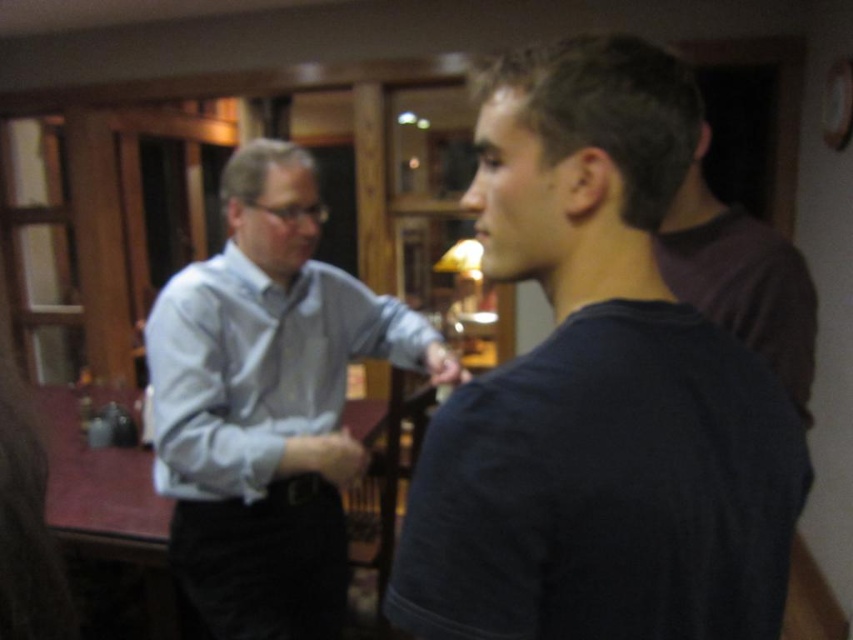
Does dark blue t-shirt at center have a greater height compared to light blue shirt at center?

No, dark blue t-shirt at center is not taller than light blue shirt at center.

Can you confirm if dark blue t-shirt at center is positioned above light blue shirt at center?

Yes.

Which is behind, point (453, 433) or point (167, 371)?

The point (167, 371) is behind.

The image size is (853, 640). Find the location of `dark blue t-shirt at center`. dark blue t-shirt at center is located at coordinates (598, 390).

Where is `dark blue t-shirt at center`? dark blue t-shirt at center is located at coordinates [x=598, y=390].

Which is behind, point (566, 154) or point (265, 310)?

The point (265, 310) is behind.

Measure the distance between dark blue t-shirt at center and camera.

They are 21.97 inches apart.

Where is `dark blue t-shirt at center`? dark blue t-shirt at center is located at coordinates (598, 390).

Can you confirm if light blue shirt at center is positioned below light blue cotton shirt at left?

Correct, light blue shirt at center is located below light blue cotton shirt at left.

You are a GUI agent. You are given a task and a screenshot of the screen. Output one action in this format:
    pyautogui.click(x=<x>, y=<y>)
    Task: Click on the light blue shirt at center
    The width and height of the screenshot is (853, 640).
    Given the screenshot: What is the action you would take?
    pyautogui.click(x=267, y=404)

Locate an element on the screen. The image size is (853, 640). light blue shirt at center is located at coordinates (267, 404).

I want to click on light blue shirt at center, so click(x=267, y=404).